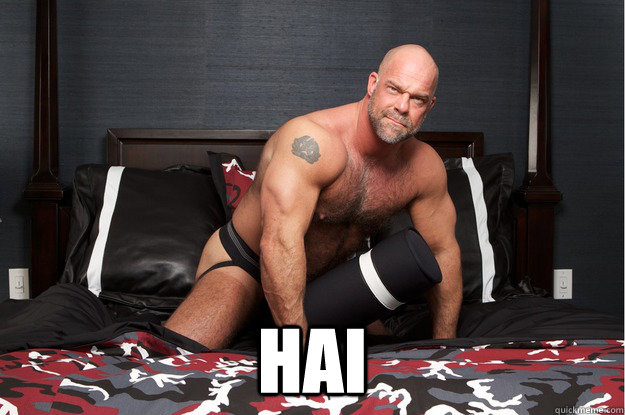
Identify the location of light switch. Image resolution: width=625 pixels, height=415 pixels. (556, 276), (14, 289).